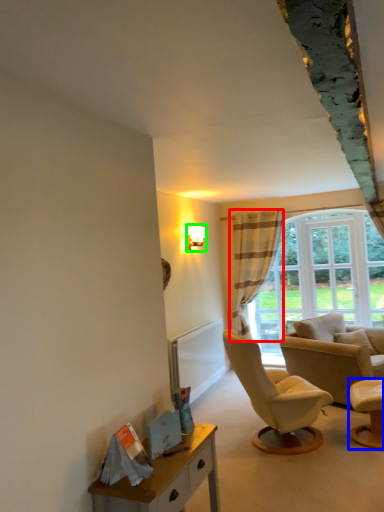
Question: Based on their relative distances, which object is farther from curtain (highlighted by a red box)? Choose from chair (highlighted by a blue box) and lamp (highlighted by a green box).

Choices:
 (A) chair
 (B) lamp

Answer: (A)